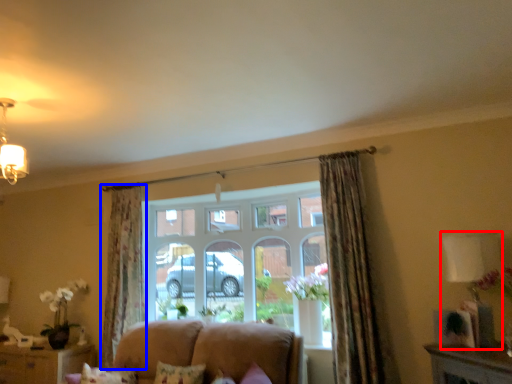
Question: Among these objects, which one is nearest to the camera, lamp (highlighted by a red box) or curtain (highlighted by a blue box)?

Choices:
 (A) lamp
 (B) curtain

Answer: (A)